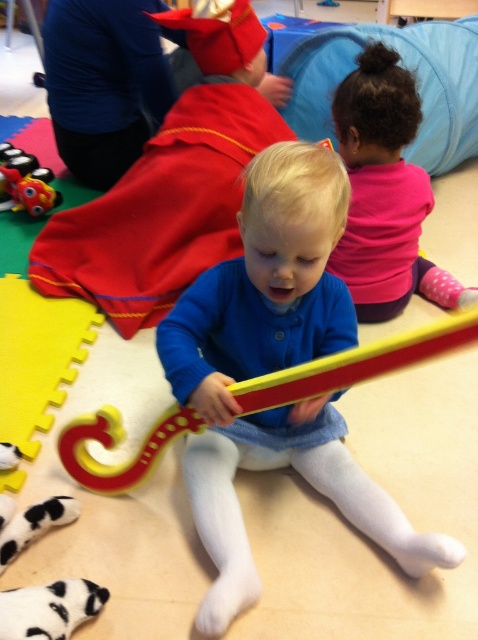
You are standing in the playroom and want to place a small toy on the floor between the two points, point (x=372, y=531) and point (x=10, y=170). Since the toy is 0.5 meters tall, will it fit vertically between the two points?

The toy will not fit vertically between the two points because the vertical distance between them is less than 0.5 meters.

You are a parent trying to retrieve the matte plastic train at left for your child. The blue soft sweater at center is in the way. If you can reach 1.5 meters, can you grab the train without moving the sweater?

The blue soft sweater at center and matte plastic train at left are 1.51 meters apart. Since the distance is slightly more than 1.5 meters, you cannot reach the train without moving the sweater.